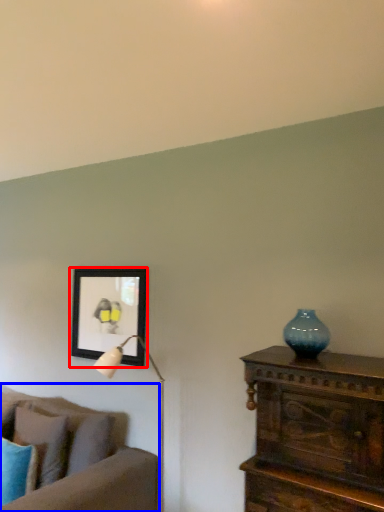
Question: Which of the following is the closest to the observer, picture frame (highlighted by a red box) or studio couch (highlighted by a blue box)?

Choices:
 (A) picture frame
 (B) studio couch

Answer: (B)